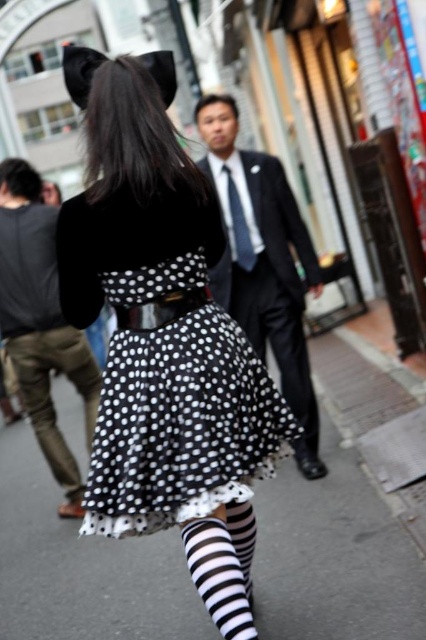
Question: Which object appears closest to the camera in this image?

Choices:
 (A) black polka dot skirt at center
 (B) black velvet dress at center
 (C) black suit at center

Answer: (B)

Question: Considering the real-world distances, which object is farthest from the black suit at center?

Choices:
 (A) black and white striped socks at lower center
 (B) silky blue tie at center

Answer: (A)

Question: Is black polka dot skirt at center further to camera compared to black satin skirt at center?

Choices:
 (A) yes
 (B) no

Answer: (A)

Question: Which object is the closest to the silky blue tie at center?

Choices:
 (A) black velvet dress at center
 (B) black satin skirt at center
 (C) black fabric skirt at center
 (D) black suit at center

Answer: (D)

Question: Can you confirm if black fabric skirt at center is smaller than black satin skirt at center?

Choices:
 (A) no
 (B) yes

Answer: (A)

Question: Is black velvet dress at center above black satin skirt at center?

Choices:
 (A) yes
 (B) no

Answer: (A)